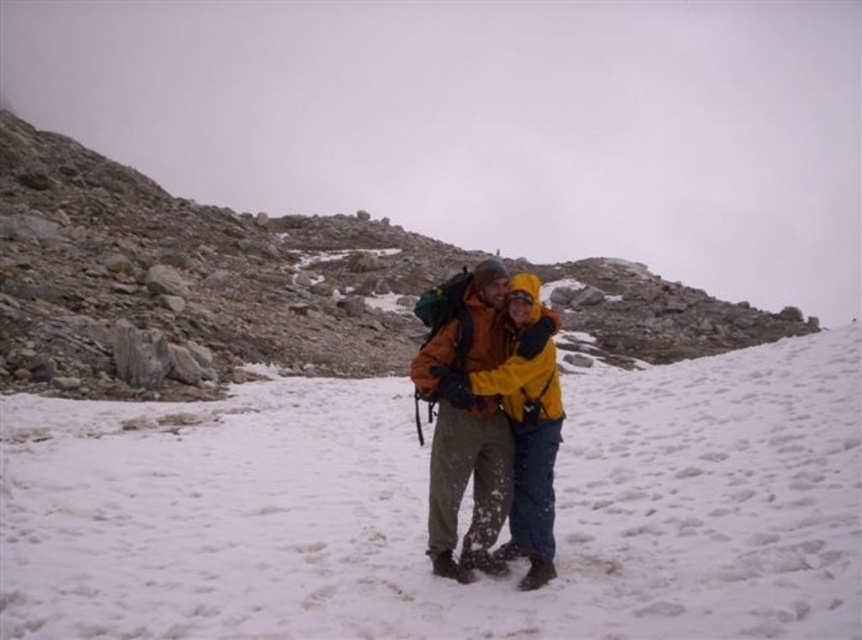
You are a hiker planning to take a photo of both the rough stone mountain at center and the orange softshell jacket at center. Which object should you position closer to the left side of your camera frame to include both in the photo?

The rough stone mountain at center should be positioned closer to the left side of your camera frame because it is already to the left of the orange softshell jacket at center.

You are planning to set up a tent on the white powdery snow at center. Considering the rough stone mountain at center nearby, which object would provide better shelter from the wind?

The rough stone mountain at center would provide better shelter from the wind because it is taller than the white powdery snow at center.